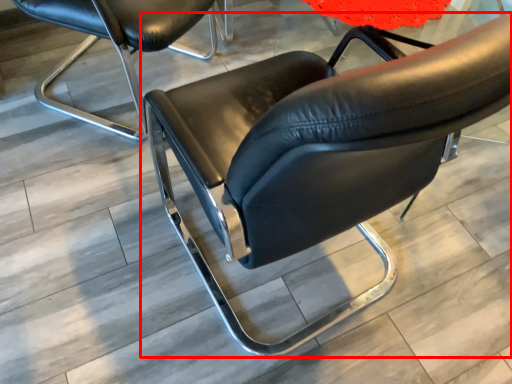
Question: In this image, where is chair (annotated by the red box) located relative to chair?

Choices:
 (A) right
 (B) left

Answer: (A)